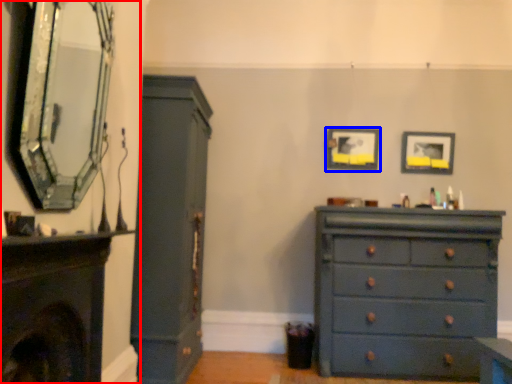
Question: Which object is further to the camera taking this photo, fireplace (highlighted by a red box) or picture frame (highlighted by a blue box)?

Choices:
 (A) fireplace
 (B) picture frame

Answer: (B)